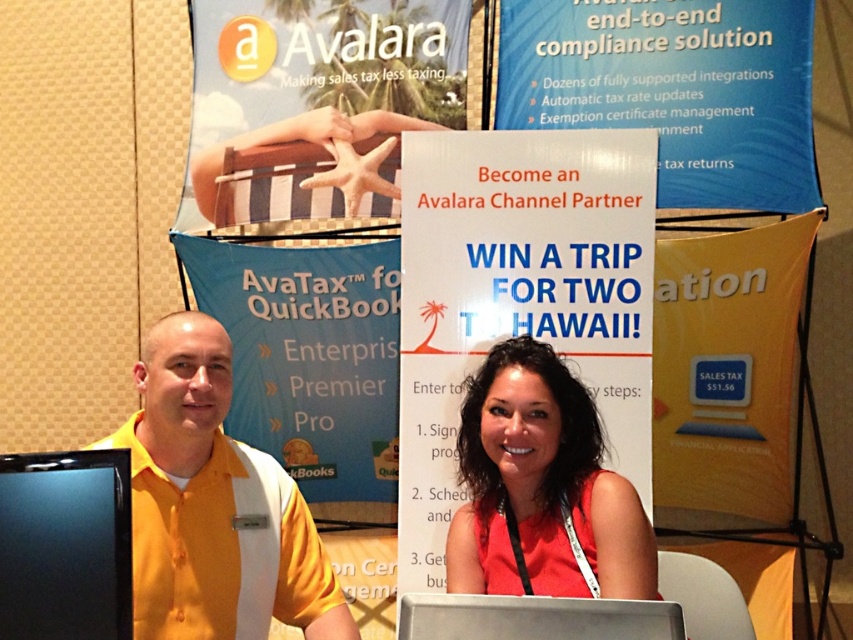
The image size is (853, 640). What do you see at coordinates (541, 488) in the screenshot?
I see `red satin dress at center` at bounding box center [541, 488].

Can you confirm if red satin dress at center is bigger than silver metallic laptop at center?

Yes, red satin dress at center is bigger than silver metallic laptop at center.

Between point (613, 525) and point (436, 632), which one is positioned in front?

Positioned in front is point (436, 632).

Locate an element on the screen. red satin dress at center is located at coordinates (541, 488).

Can you confirm if yellow shirt at center is wider than red satin dress at center?

Yes, yellow shirt at center is wider than red satin dress at center.

Is point (279, 472) closer to camera compared to point (537, 433)?

No.

Identify the location of yellow shirt at center. This screenshot has width=853, height=640. (213, 506).

Is yellow shirt at center above silver metallic laptop at center?

Yes.

The image size is (853, 640). Find the location of `yellow shirt at center`. yellow shirt at center is located at coordinates (213, 506).